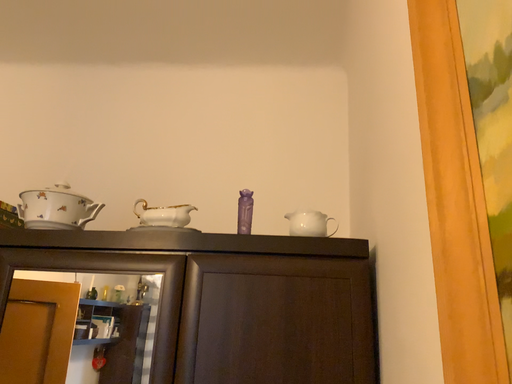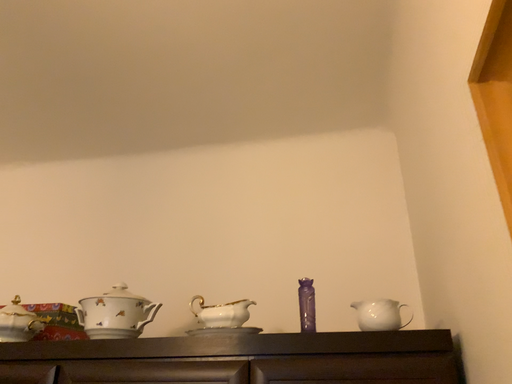
Question: Which way did the camera rotate in the video?

Choices:
 (A) rotated right
 (B) rotated left

Answer: (B)